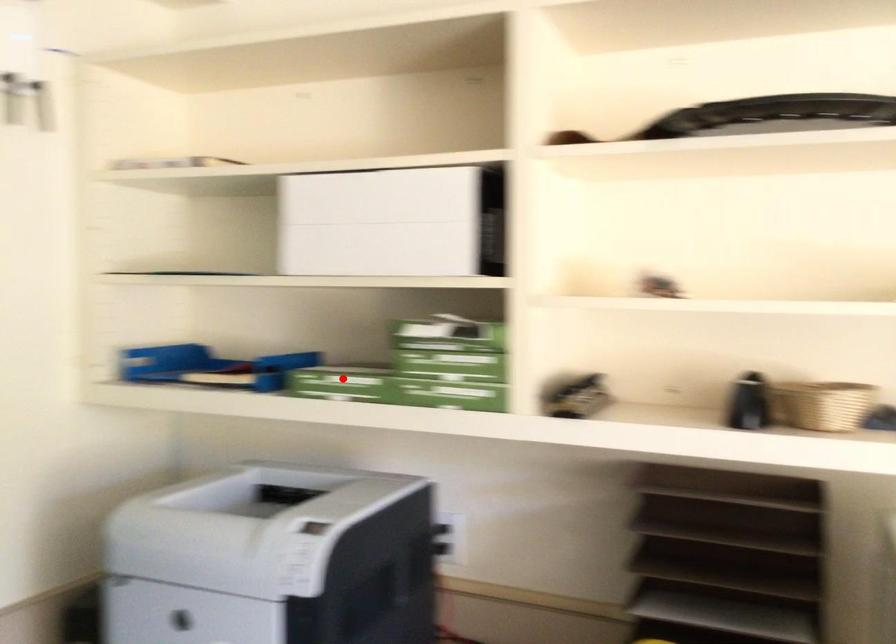
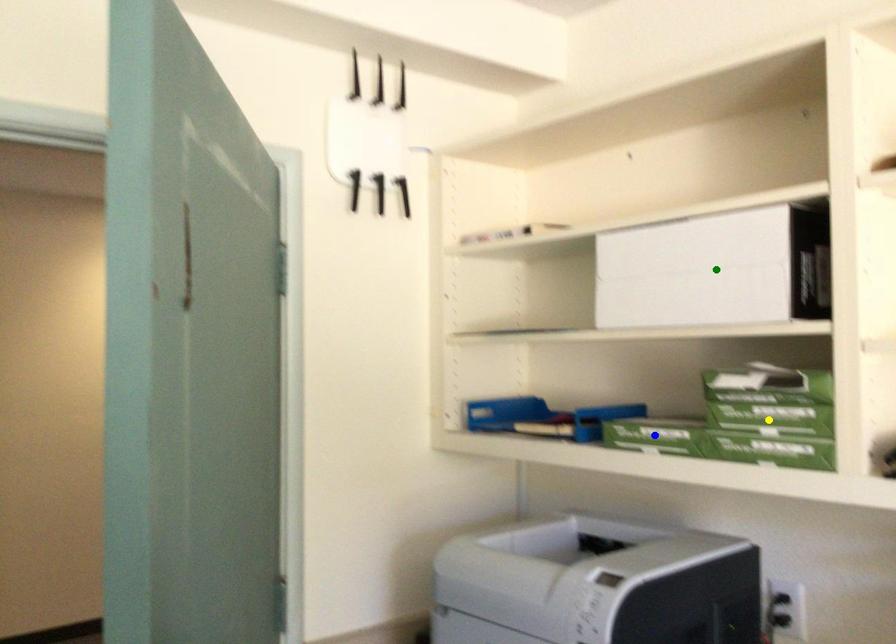
Question: I am providing you with two images of the same scene from different viewpoints. A red point is marked on the first image. You are given multiple points on the second image. Which point in image 2 is actually the same real-world point as the red point in image 1?

Choices:
 (A) yellow point
 (B) blue point
 (C) green point

Answer: (B)